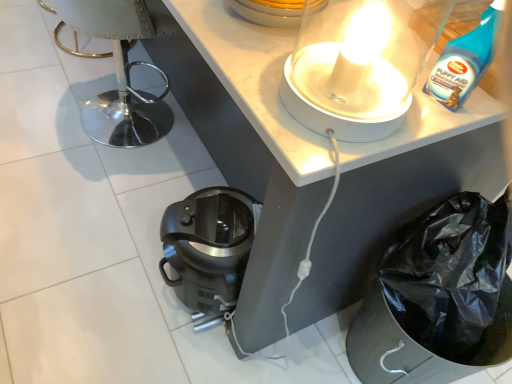
The width and height of the screenshot is (512, 384). Identify the location of free space above black plastic coffee maker at lower center (from a real-world perspective). (223, 220).